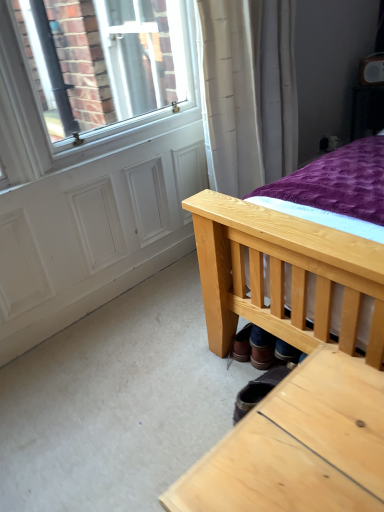
At what (x,y) coordinates should I click in order to perform the action: click on free spot above white matte screen door at lower left (from a real-world perspective). Please return your answer as a coordinate pair (x, y). Looking at the image, I should click on (111, 278).